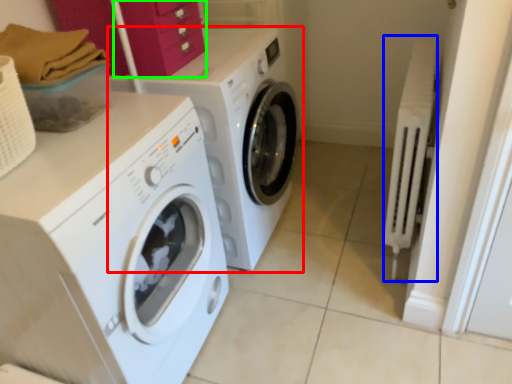
Question: Considering the real-world distances, which object is farthest from washing machine (highlighted by a red box)? radiator (highlighted by a blue box) or drawer (highlighted by a green box)?

Choices:
 (A) radiator
 (B) drawer

Answer: (A)